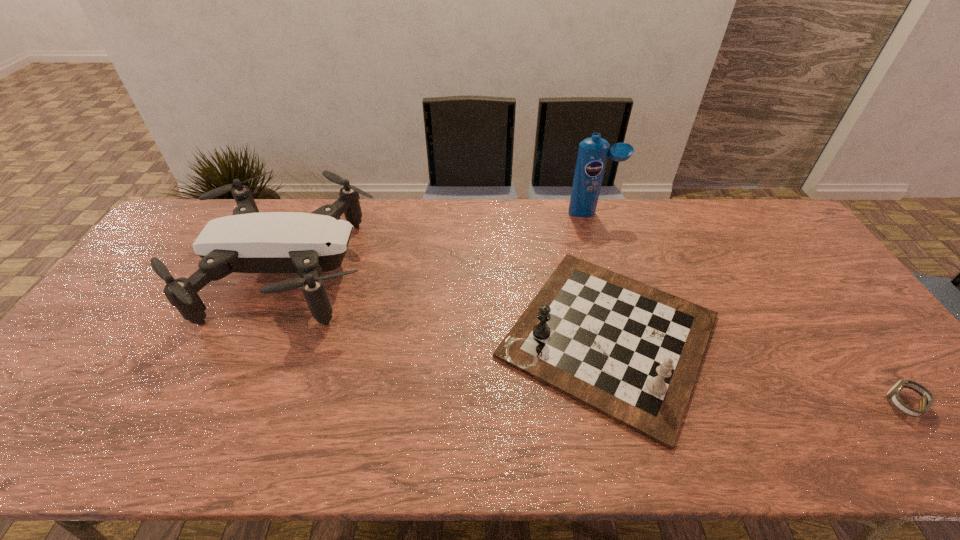
Where is `free space between the gameboard and the drone`? This screenshot has width=960, height=540. free space between the gameboard and the drone is located at coordinates [450, 303].

This screenshot has width=960, height=540. What are the coordinates of `vacant region between the gameboard and the leftmost object` in the screenshot? It's located at (450, 303).

The height and width of the screenshot is (540, 960). In order to click on free spot between the third tallest object and the watch in this screenshot , I will do `click(756, 370)`.

Find the location of a particular element. The image size is (960, 540). unoccupied position between the gameboard and the watch is located at coordinates (756, 370).

What are the coordinates of `free space between the drone and the gameboard` in the screenshot? It's located at (450, 303).

At what (x,y) coordinates should I click in order to perform the action: click on free spot between the shampoo and the drone. Please return your answer as a coordinate pair (x, y). This screenshot has width=960, height=540. Looking at the image, I should click on (442, 241).

Locate an element on the screen. The width and height of the screenshot is (960, 540). object that is the second closest to the leftmost object is located at coordinates (592, 156).

Find the location of a particular element. object that is the second closest to the tallest object is located at coordinates (248, 241).

This screenshot has height=540, width=960. In order to click on vacant region that satisfies the following two spatial constraints: 1. on the front side of the shampoo; 2. on the camera side of the drone in this screenshot , I will do `click(610, 270)`.

Where is `free location that satisfies the following two spatial constraints: 1. on the camera side of the second shortest object; 2. on the right side of the drone`? free location that satisfies the following two spatial constraints: 1. on the camera side of the second shortest object; 2. on the right side of the drone is located at coordinates (263, 336).